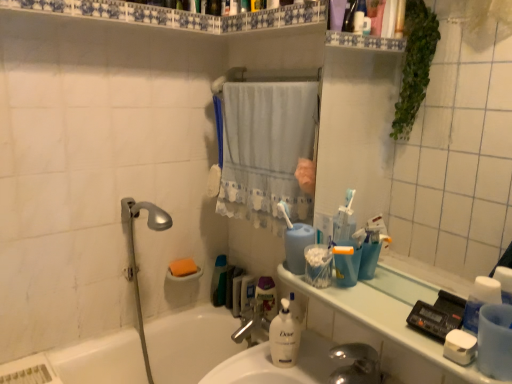
Image resolution: width=512 pixels, height=384 pixels. Identify the location of vacant space situated on the left part of white matte bottle at center, placed as the second cleaning product when sorted from top to bottom. (248, 369).